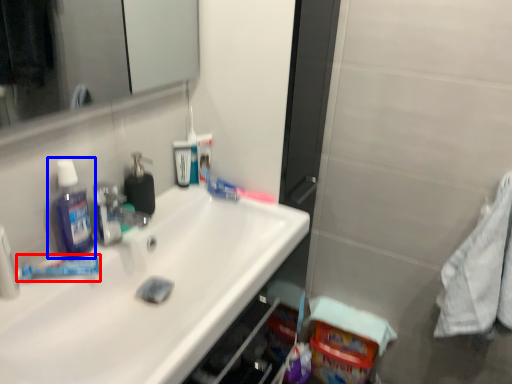
Question: Which object appears closest to the camera in this image, toothpaste (highlighted by a red box) or mouthwash (highlighted by a blue box)?

Choices:
 (A) toothpaste
 (B) mouthwash

Answer: (B)